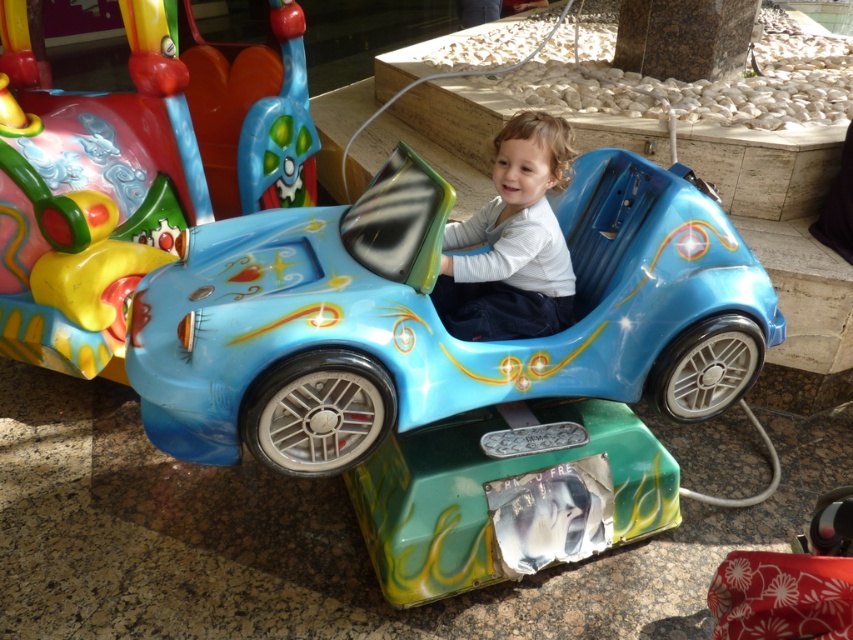
Question: Which of these objects is positioned farthest from the shiny plastic toy car at center?

Choices:
 (A) matte blue car seat at center
 (B) glossy plastic car at center

Answer: (B)

Question: Is glossy plastic car at center positioned at the back of matte blue car seat at center?

Choices:
 (A) no
 (B) yes

Answer: (B)

Question: Can you confirm if glossy plastic car at center is smaller than matte blue car seat at center?

Choices:
 (A) no
 (B) yes

Answer: (A)

Question: Among these objects, which one is farthest from the camera?

Choices:
 (A) matte blue car seat at center
 (B) glossy plastic car at center
 (C) shiny plastic toy car at center

Answer: (B)

Question: Which object is farther from the camera taking this photo?

Choices:
 (A) matte blue car seat at center
 (B) glossy plastic car at center
 (C) shiny plastic toy car at center

Answer: (B)

Question: Is glossy plastic car at center positioned at the back of matte blue car seat at center?

Choices:
 (A) yes
 (B) no

Answer: (A)